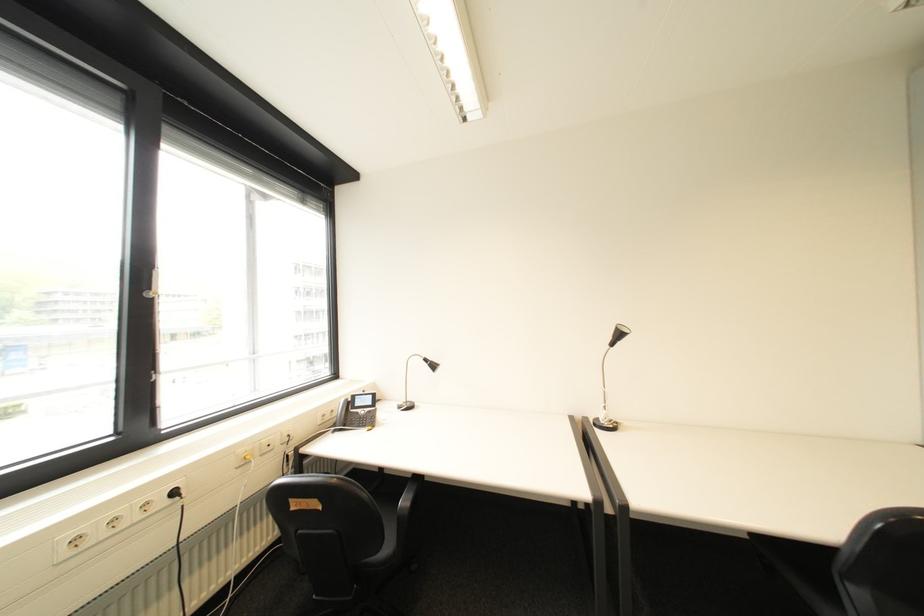
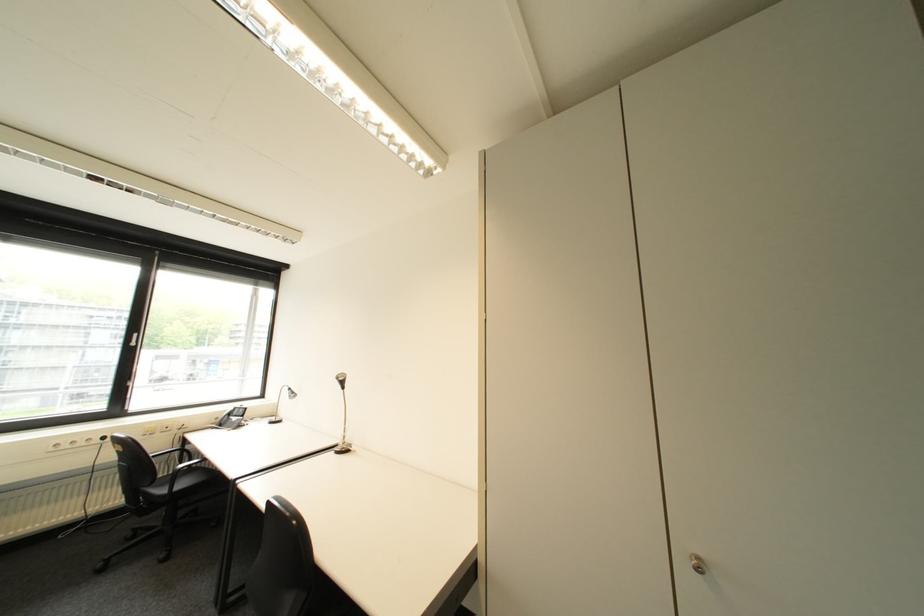
Locate, in the second image, the point that corresponds to the point at 185,493 in the first image.

(114, 439)